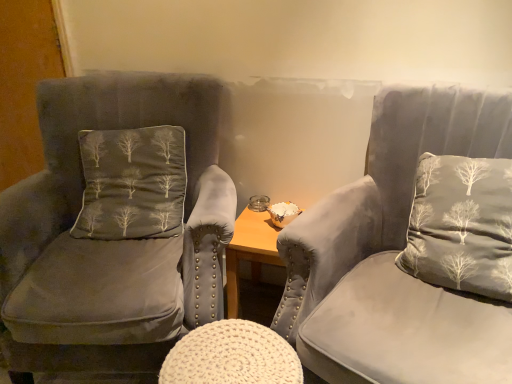
Question: Is dark gray velvet pillow with tree pattern at left, which ranks as the 2th pillow in right-to-left order, taller than gray fabric pillow at right, arranged as the 1th pillow when viewed from the right?

Choices:
 (A) yes
 (B) no

Answer: (B)

Question: Is dark gray velvet pillow with tree pattern at left, positioned as the 1th pillow in left-to-right order, behind gray fabric pillow at right, which is counted as the second pillow, starting from the left?

Choices:
 (A) no
 (B) yes

Answer: (B)

Question: Does dark gray velvet pillow with tree pattern at left, positioned as the 1th pillow in left-to-right order, have a larger size compared to gray fabric pillow at right, which is counted as the second pillow, starting from the left?

Choices:
 (A) no
 (B) yes

Answer: (A)

Question: Is dark gray velvet pillow with tree pattern at left, which ranks as the 2th pillow in right-to-left order, shorter than gray fabric pillow at right, arranged as the 1th pillow when viewed from the right?

Choices:
 (A) no
 (B) yes

Answer: (B)

Question: From the image's perspective, is dark gray velvet pillow with tree pattern at left, positioned as the 1th pillow in left-to-right order, under gray fabric pillow at right, arranged as the 1th pillow when viewed from the right?

Choices:
 (A) yes
 (B) no

Answer: (B)

Question: Is suede gray chair at left, which is the first chair in left-to-right order, wider or thinner than dark gray velvet pillow with tree pattern at left, which ranks as the 2th pillow in right-to-left order?

Choices:
 (A) wide
 (B) thin

Answer: (A)

Question: Considering their positions, is suede gray chair at left, which is the first chair in left-to-right order, located in front of or behind dark gray velvet pillow with tree pattern at left, positioned as the 1th pillow in left-to-right order?

Choices:
 (A) behind
 (B) front

Answer: (B)

Question: From the image's perspective, is suede gray chair at left, which is the first chair in left-to-right order, positioned above or below dark gray velvet pillow with tree pattern at left, positioned as the 1th pillow in left-to-right order?

Choices:
 (A) above
 (B) below

Answer: (B)

Question: Considering the relative positions of suede gray chair at left, which appears as the 2th chair when viewed from the right, and dark gray velvet pillow with tree pattern at left, which ranks as the 2th pillow in right-to-left order, in the image provided, is suede gray chair at left, which appears as the 2th chair when viewed from the right, to the left or to the right of dark gray velvet pillow with tree pattern at left, which ranks as the 2th pillow in right-to-left order,?

Choices:
 (A) left
 (B) right

Answer: (A)

Question: Considering the relative positions of velvet gray chair at right, arranged as the first chair when viewed from the right, and dark gray velvet pillow with tree pattern at left, which ranks as the 2th pillow in right-to-left order, in the image provided, is velvet gray chair at right, arranged as the first chair when viewed from the right, to the left or to the right of dark gray velvet pillow with tree pattern at left, which ranks as the 2th pillow in right-to-left order,?

Choices:
 (A) left
 (B) right

Answer: (B)

Question: From a real-world perspective, relative to dark gray velvet pillow with tree pattern at left, positioned as the 1th pillow in left-to-right order, is velvet gray chair at right, the 2th chair from the left, vertically above or below?

Choices:
 (A) above
 (B) below

Answer: (B)

Question: From the image's perspective, is velvet gray chair at right, the 2th chair from the left, located above or below dark gray velvet pillow with tree pattern at left, which ranks as the 2th pillow in right-to-left order?

Choices:
 (A) above
 (B) below

Answer: (B)

Question: Would you say velvet gray chair at right, the 2th chair from the left, is inside or outside dark gray velvet pillow with tree pattern at left, positioned as the 1th pillow in left-to-right order?

Choices:
 (A) inside
 (B) outside

Answer: (B)

Question: Is velvet gray chair at right, arranged as the first chair when viewed from the right, in front of or behind gray fabric pillow at right, which is counted as the second pillow, starting from the left, in the image?

Choices:
 (A) front
 (B) behind

Answer: (A)

Question: Would you say velvet gray chair at right, the 2th chair from the left, is to the left or to the right of gray fabric pillow at right, which is counted as the second pillow, starting from the left, in the picture?

Choices:
 (A) right
 (B) left

Answer: (B)